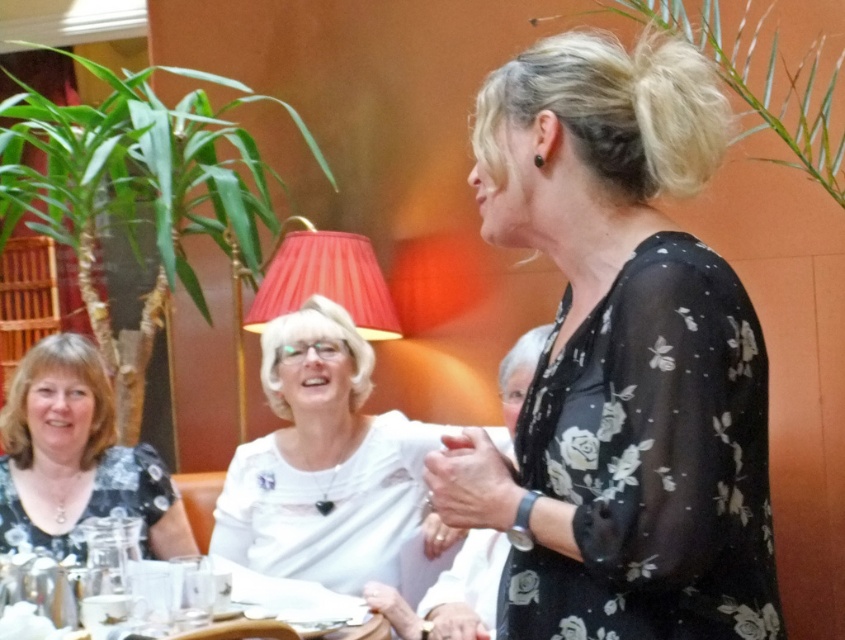
You are at a dinner party and want to introduce yourself to the person wearing the black floral blouse at center and the white satin blouse at center. Which one should you approach first if you are standing to the left of both?

You should approach the white satin blouse at center first because the black floral blouse at center is to the right of it, so the white satin blouse at center is closer to your left side.

From the picture: You are a photographer at the event and want to capture a closeup of the white satin blouse at center and the clear glassware at lower left. Which object should you zoom in on first to ensure it fits in the frame?

The white satin blouse at center is larger in size than the clear glassware at lower left, so you should zoom in on the white satin blouse at center first to ensure it fits in the frame before adjusting for the smaller clear glassware at lower left.